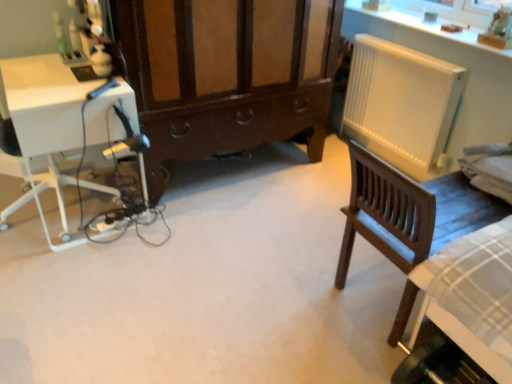
Locate an element on the screen. This screenshot has height=384, width=512. unoccupied area in front of white plastic computer desk at left is located at coordinates (81, 281).